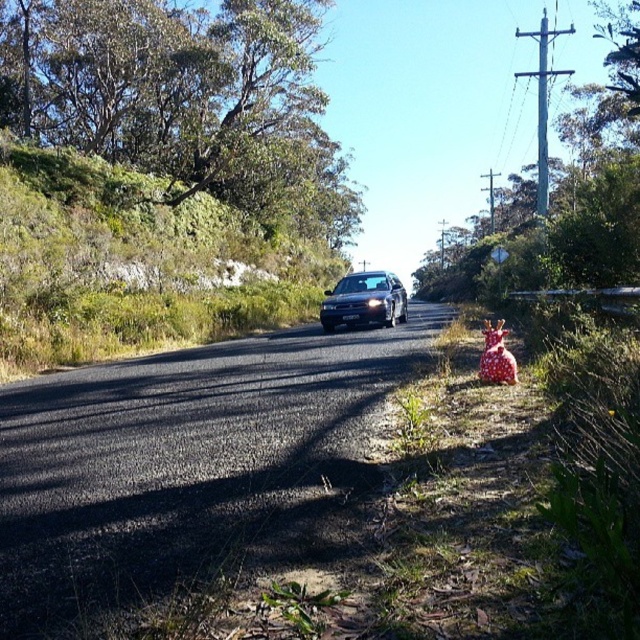
Between black asphalt road at center and satin black sedan at center, which one appears on the left side from the viewer's perspective?

Positioned to the left is black asphalt road at center.

Which is above, black asphalt road at center or satin black sedan at center?

satin black sedan at center is above.

Locate an element on the screen. Image resolution: width=640 pixels, height=640 pixels. black asphalt road at center is located at coordinates (186, 464).